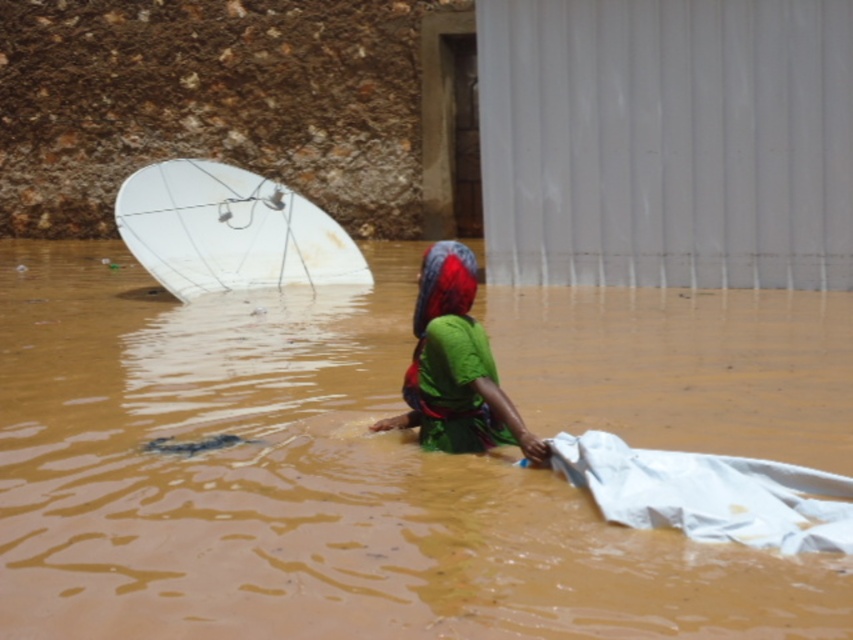
Does brown muddy water at center have a greater height compared to green fabric at center?

Indeed, brown muddy water at center has a greater height compared to green fabric at center.

Which of these two, brown muddy water at center or green fabric at center, stands taller?

brown muddy water at center

This screenshot has width=853, height=640. Find the location of `brown muddy water at center`. brown muddy water at center is located at coordinates (306, 484).

Does white glossy satellite dish at upper left have a larger size compared to white fabric at lower right?

Yes.

Identify the location of white glossy satellite dish at upper left. (229, 230).

The width and height of the screenshot is (853, 640). Find the location of `white glossy satellite dish at upper left`. white glossy satellite dish at upper left is located at coordinates (229, 230).

Does white glossy satellite dish at upper left come behind green fabric at center?

Yes.

The width and height of the screenshot is (853, 640). Find the location of `white glossy satellite dish at upper left`. white glossy satellite dish at upper left is located at coordinates (229, 230).

The image size is (853, 640). I want to click on white glossy satellite dish at upper left, so click(229, 230).